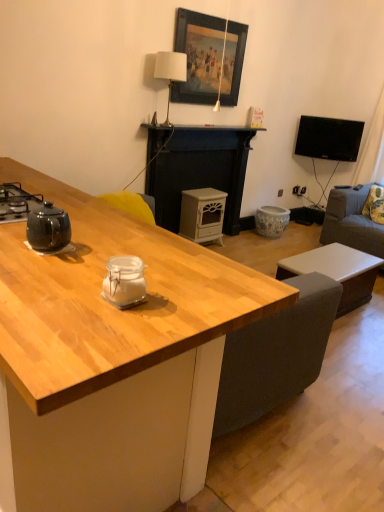
Question: Is black glossy tv at upper right taller than white matte fireplace at center?

Choices:
 (A) yes
 (B) no

Answer: (B)

Question: Is black glossy tv at upper right positioned before white matte fireplace at center?

Choices:
 (A) yes
 (B) no

Answer: (B)

Question: From the image's perspective, is black glossy tv at upper right on white matte fireplace at center?

Choices:
 (A) yes
 (B) no

Answer: (A)

Question: From the image's perspective, is black glossy tv at upper right located beneath white matte fireplace at center?

Choices:
 (A) no
 (B) yes

Answer: (A)

Question: Are black glossy tv at upper right and white matte fireplace at center far apart?

Choices:
 (A) no
 (B) yes

Answer: (B)

Question: Is gray fabric couch at right situated inside white matte wood stove at center, placed as the 1th appliance when sorted from right to left, or outside?

Choices:
 (A) inside
 (B) outside

Answer: (B)

Question: Is point (344, 199) closer or farther from the camera than point (201, 233)?

Choices:
 (A) closer
 (B) farther

Answer: (B)

Question: Considering the relative positions of gray fabric couch at right and white matte wood stove at center, which appears as the 2th appliance when ordered from the bottom, in the image provided, is gray fabric couch at right to the left or to the right of white matte wood stove at center, which appears as the 2th appliance when ordered from the bottom,?

Choices:
 (A) left
 (B) right

Answer: (B)

Question: In terms of width, does gray fabric couch at right look wider or thinner when compared to white matte wood stove at center, which is counted as the 2th appliance, starting from the left?

Choices:
 (A) wide
 (B) thin

Answer: (A)

Question: From the image's perspective, relative to shiny black kettle at left, is white matte rectangular table at lower right above or below?

Choices:
 (A) below
 (B) above

Answer: (A)

Question: Is white matte rectangular table at lower right inside the boundaries of shiny black kettle at left, or outside?

Choices:
 (A) inside
 (B) outside

Answer: (B)

Question: Considering the relative positions of white matte rectangular table at lower right and shiny black kettle at left in the image provided, is white matte rectangular table at lower right to the left or to the right of shiny black kettle at left?

Choices:
 (A) left
 (B) right

Answer: (B)

Question: From a real-world perspective, relative to shiny black kettle at left, is white matte rectangular table at lower right vertically above or below?

Choices:
 (A) below
 (B) above

Answer: (A)

Question: Considering the positions of gray fabric couch at right and wooden framed painting at upper center in the image, is gray fabric couch at right taller or shorter than wooden framed painting at upper center?

Choices:
 (A) short
 (B) tall

Answer: (A)

Question: Is gray fabric couch at right wider or thinner than wooden framed painting at upper center?

Choices:
 (A) wide
 (B) thin

Answer: (A)